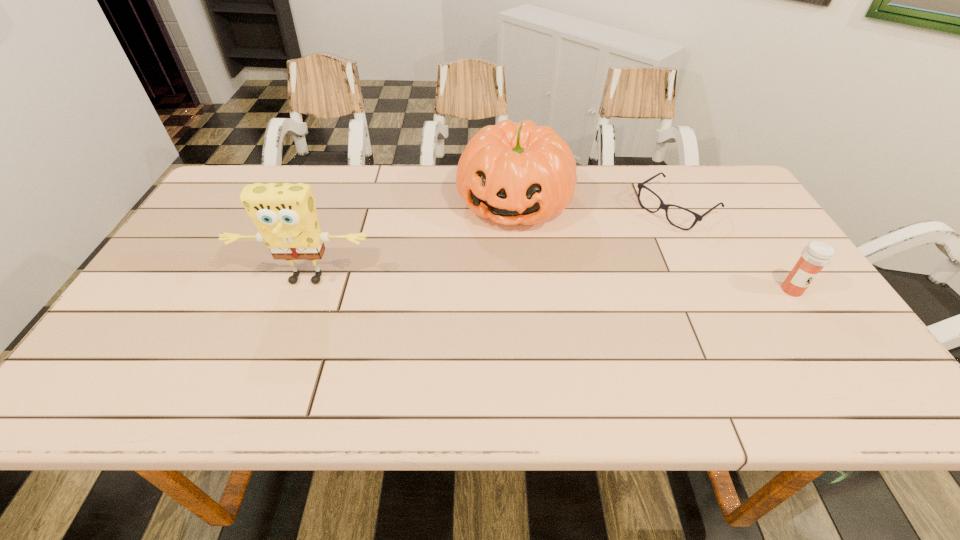
The image size is (960, 540). I want to click on free space located 0.250m on the front-facing side of the shortest object, so click(594, 264).

Where is `vacant space located 0.240m on the carved face of the pumpkin`? vacant space located 0.240m on the carved face of the pumpkin is located at coordinates (476, 302).

This screenshot has width=960, height=540. I want to click on free space located 0.330m on the carved face of the pumpkin, so click(x=465, y=331).

You are a GUI agent. You are given a task and a screenshot of the screen. Output one action in this format:
    pyautogui.click(x=<x>, y=<y>)
    Task: Click on the free region located 0.320m on the carved face of the pumpkin
    The height and width of the screenshot is (540, 960).
    Given the screenshot: What is the action you would take?
    pyautogui.click(x=467, y=328)

Where is `spectacles present at the far edge`? The image size is (960, 540). spectacles present at the far edge is located at coordinates (663, 206).

Where is `pumpkin present at the far edge`? This screenshot has height=540, width=960. pumpkin present at the far edge is located at coordinates (512, 173).

Identify the location of medicine that is at the right edge. (817, 254).

This screenshot has width=960, height=540. What are the coordinates of `spectacles positioned at the right edge` in the screenshot? It's located at (663, 206).

Locate an element on the screen. The width and height of the screenshot is (960, 540). object that is at the far right corner is located at coordinates (663, 206).

Where is `vacant space at the far edge of the desktop`? This screenshot has width=960, height=540. vacant space at the far edge of the desktop is located at coordinates (614, 208).